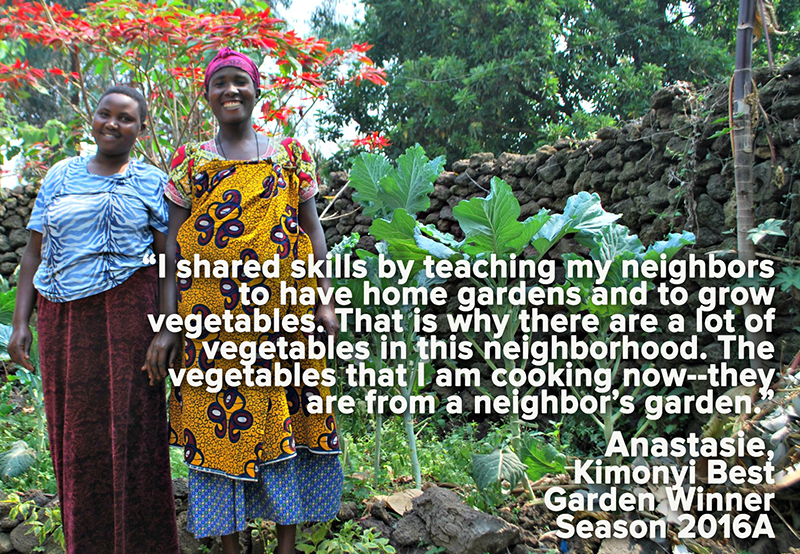
Find the location of `plant leaves`. plant leaves is located at coordinates (412, 184), (502, 217).